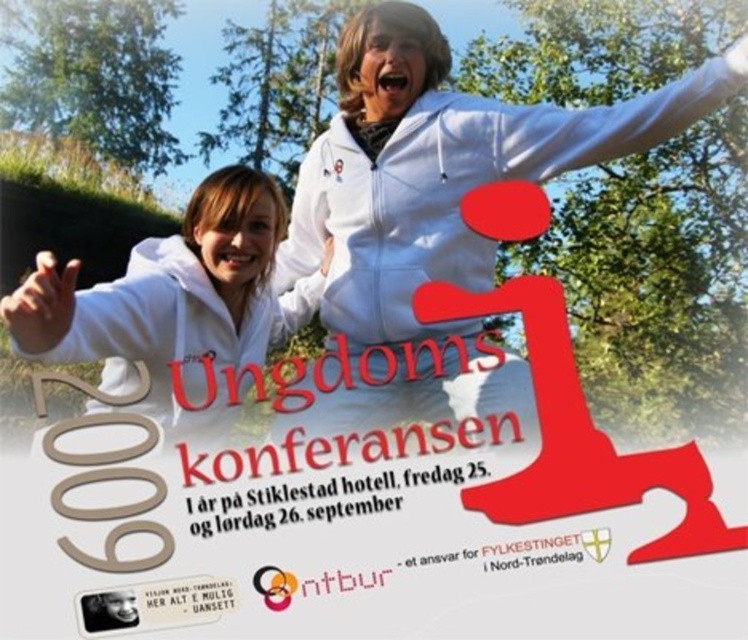
In the scene shown: You are designing a promotional poster for a youth conference. You have two elements to place on the poster. The first is the white matte hoodie at center, and the second is the white matte arm at upper left. If you want to ensure that the hoodie is more prominent than the arm, which element should you make larger?

The white matte hoodie at center should be made larger than the white matte arm at upper left because the hoodie is already positioned at the center of the poster, making it naturally more prominent. However, if the hoodie is wider than the arm, increasing its size further would emphasize its importance compared to the arm.

You are designing a digital poster and want to add a decorative element near the white smooth arm at upper right. To ensure it doesn not overlap, where should you place it?

The white smooth arm at upper right is located at point (619, 120), so place the decorative element slightly away from this coordinate to avoid overlap.